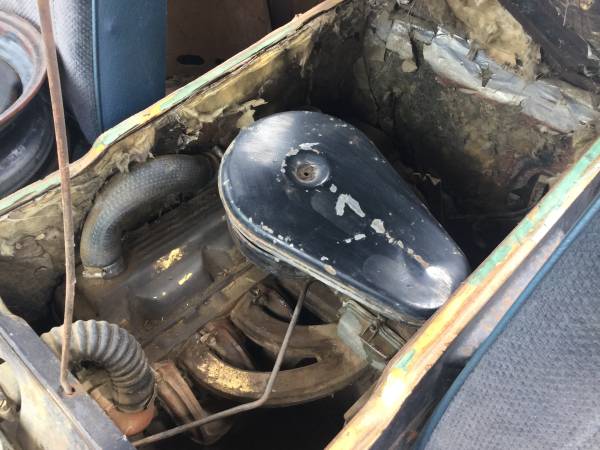
Identify the location of cable. The width and height of the screenshot is (600, 450). 65,163.